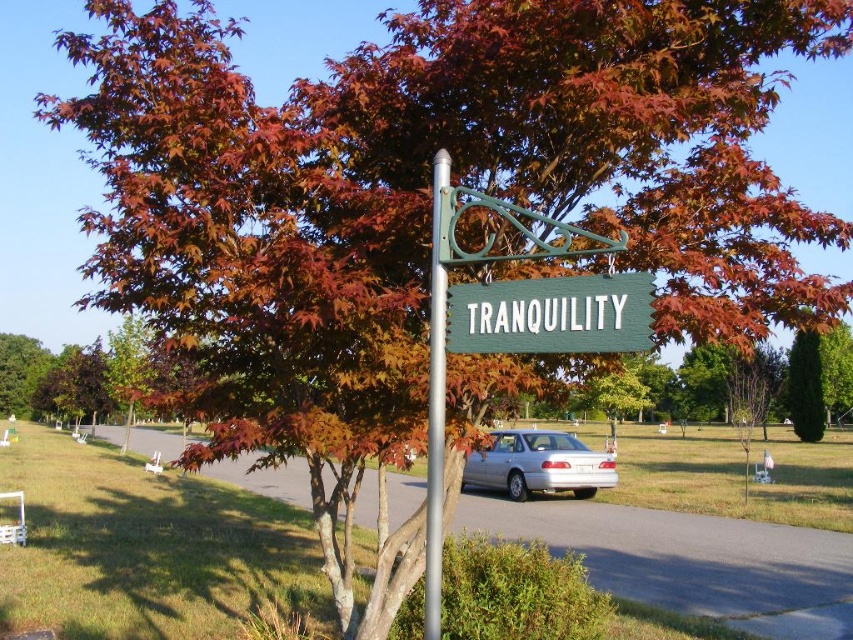
Question: Which is nearer to the silver metallic pole at center?

Choices:
 (A) green leafy tree at lower left
 (B) green textured hedge at center
 (C) green wooden sign at center

Answer: (C)

Question: Is green wood sign at center further to the viewer compared to green textured hedge at center?

Choices:
 (A) no
 (B) yes

Answer: (A)

Question: Is silver metallic sedan at center positioned before green leafy tree at lower left?

Choices:
 (A) yes
 (B) no

Answer: (A)

Question: Estimate the real-world distances between objects in this image. Which object is farther from the green textured hedge at center?

Choices:
 (A) green wood sign at center
 (B) green leafy tree at lower left
 (C) green wooden sign at center

Answer: (B)

Question: Which object appears farthest from the camera in this image?

Choices:
 (A) silver metallic pole at center
 (B) green wooden sign at center
 (C) silver metallic sedan at center
 (D) green leafy tree at lower left

Answer: (D)

Question: Where is silver metallic sedan at center located in relation to green leafy tree at lower left in the image?

Choices:
 (A) below
 (B) above

Answer: (B)